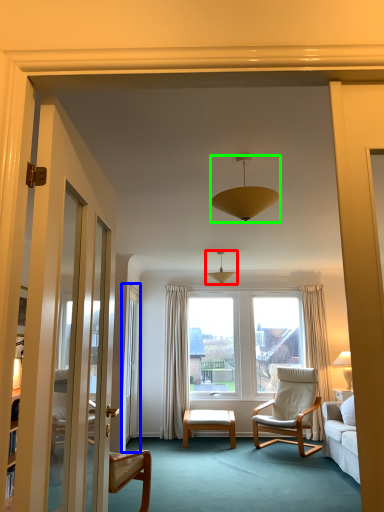
Question: Considering the real-world distances, which object is farthest from light fixture (highlighted by a red box)? screen door (highlighted by a blue box) or lamp (highlighted by a green box)?

Choices:
 (A) screen door
 (B) lamp

Answer: (B)